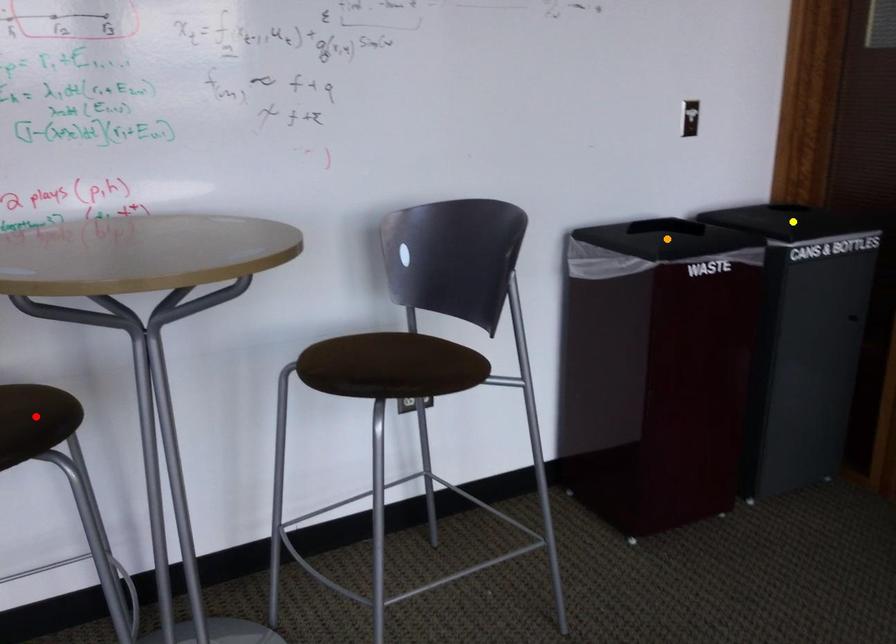
From the picture: Order these from nearest to farthest:
A) orange point
B) red point
C) yellow point

1. red point
2. orange point
3. yellow point